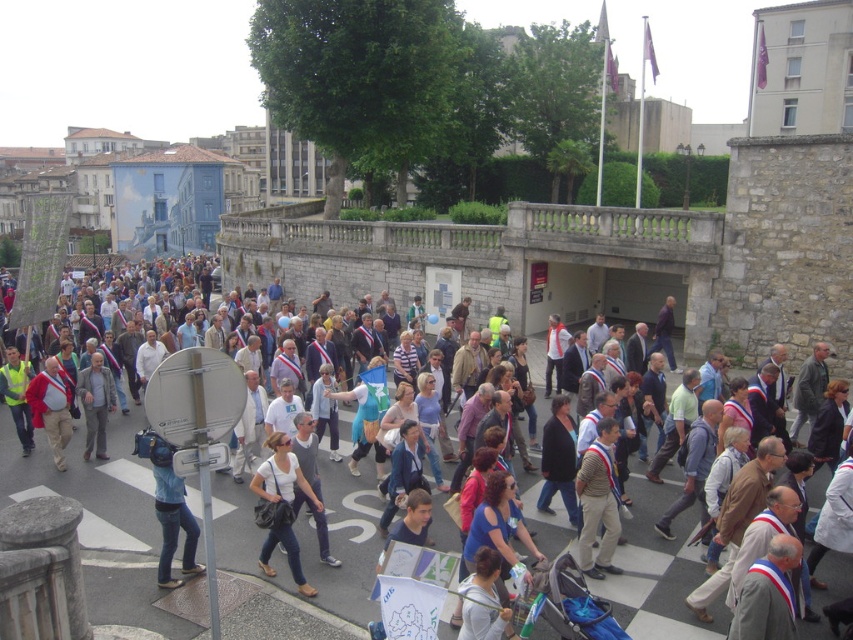
Question: Based on their relative distances, which object is nearer to the red fabric coat at center?

Choices:
 (A) striped cotton shirt at center
 (B) white matte shirt at center
 (C) white cotton shirt at center
 (D) light gray fabric jacket at center

Answer: (D)

Question: Is red fabric coat at center positioned behind light gray fabric jacket at center?

Choices:
 (A) no
 (B) yes

Answer: (A)

Question: Based on their relative distances, which object is nearer to the striped cotton shirt at center?

Choices:
 (A) red fabric coat at center
 (B) white matte shirt at center
 (C) white cotton shirt at center

Answer: (C)

Question: Considering the relative positions of striped cotton shirt at center and red fabric coat at center in the image provided, where is striped cotton shirt at center located with respect to red fabric coat at center?

Choices:
 (A) above
 (B) below

Answer: (B)

Question: Is the position of blue denim jeans at center less distant than that of light gray fabric jacket at center?

Choices:
 (A) yes
 (B) no

Answer: (A)

Question: Which of the following is the closest to the observer?

Choices:
 (A) (282, 522)
 (B) (602, 474)
 (C) (35, 384)
 (D) (107, 458)

Answer: (A)